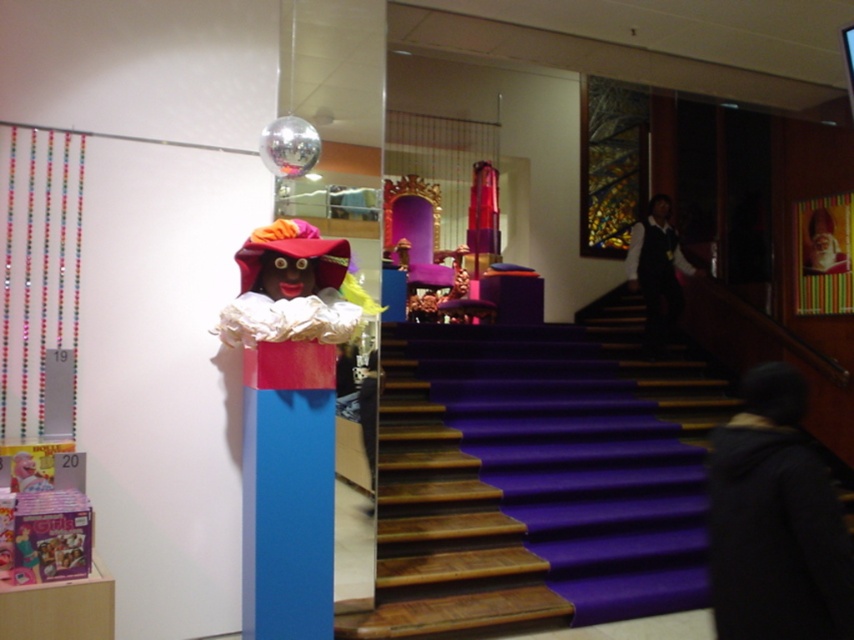
Is point (650, 323) in front of point (834, 208)?

No, it is not.

Between dark fabric dress at upper right and smooth plastic santa at upper right, which one appears on the left side from the viewer's perspective?

From the viewer's perspective, dark fabric dress at upper right appears more on the left side.

I want to click on dark fabric dress at upper right, so click(656, 272).

This screenshot has height=640, width=854. In order to click on dark fabric dress at upper right in this screenshot , I will do `click(656, 272)`.

Between point (309, 292) and point (809, 236), which one is positioned in front?

Point (309, 292) is more forward.

Can you confirm if matte pink fabric doll at center is positioned to the left of smooth plastic santa at upper right?

Correct, you'll find matte pink fabric doll at center to the left of smooth plastic santa at upper right.

Is point (288, 305) closer to viewer compared to point (823, 228)?

Yes, it is.

I want to click on matte pink fabric doll at center, so click(x=294, y=289).

Who is higher up, purple wooden stairs at center or dark fabric dress at upper right?

Positioned higher is dark fabric dress at upper right.

Who is positioned more to the left, purple wooden stairs at center or dark fabric dress at upper right?

Positioned to the left is purple wooden stairs at center.

Is point (422, 499) farther from camera compared to point (667, 234)?

No, it is in front of (667, 234).

Identify the location of purple wooden stairs at center. The width and height of the screenshot is (854, 640). (442, 522).